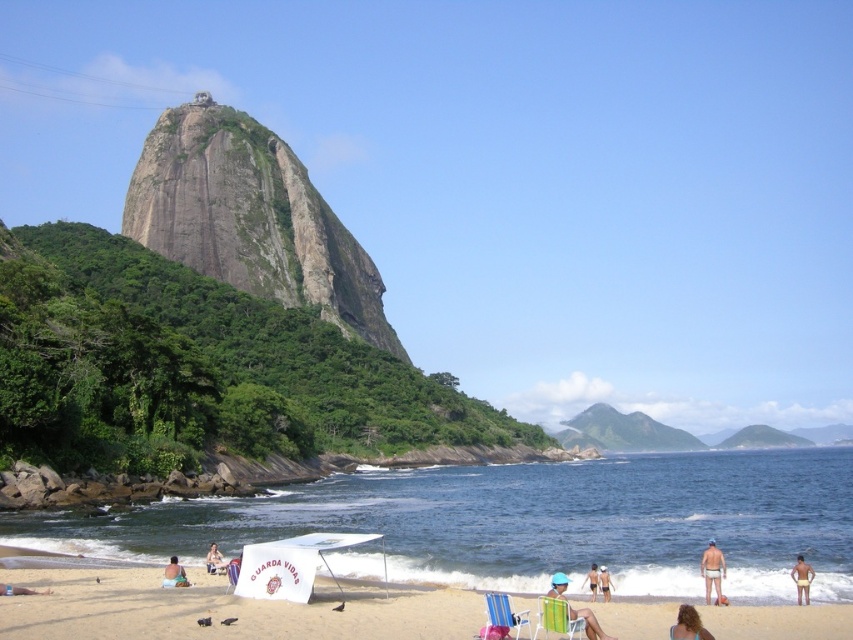
Based on the photo, you are a photographer trying to capture a photo of the green fabric beach chair at lower center and the tan skin person at center. Since the chair is positioned closer to the camera, will the chair appear larger or smaller in the photo compared to the person?

The green fabric beach chair at lower center is thinner than the tan skin person at center. Even though the chair is closer, its actual size is smaller, so it will appear smaller in the photo.

Based on the photo, you are standing at the edge of the beach facing the ocean. You see a beige fabric chair at lower center and a beige fabric towel at lower left. Which object is closer to your right side?

The beige fabric chair at lower center is closer to your right side because it is positioned to the right of the beige fabric towel at lower left.